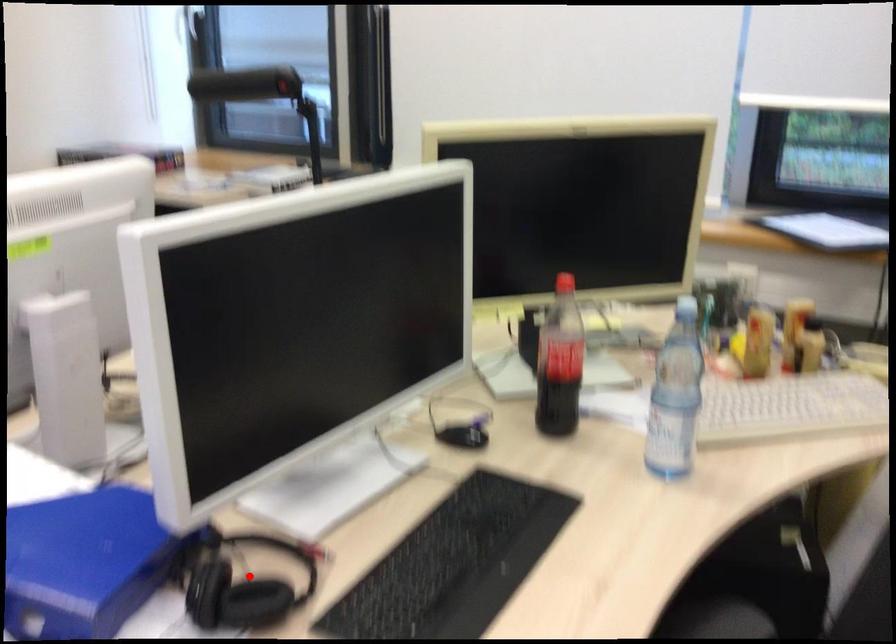
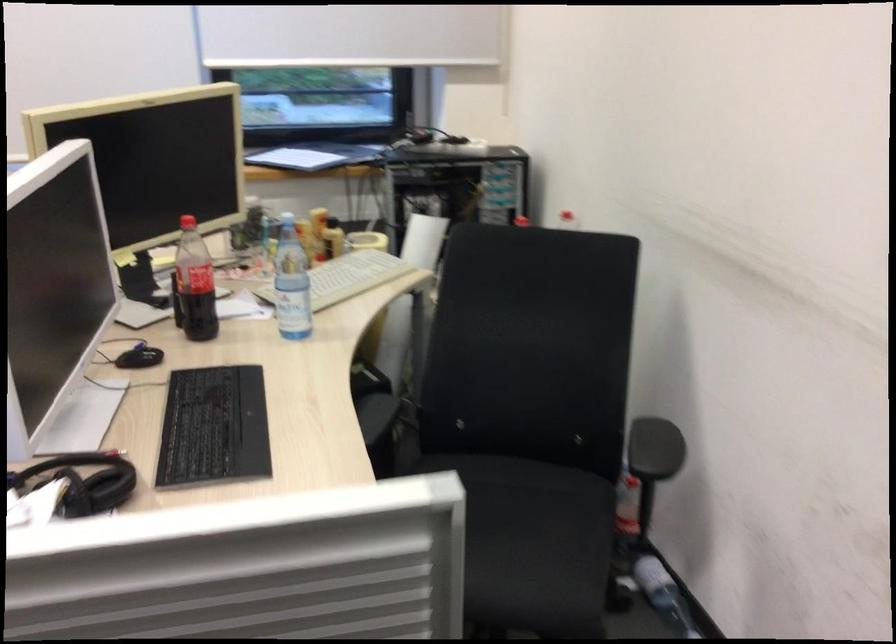
Question: I am providing you with two images of the same scene from different viewpoints. A red point is marked on the first image. At the location where the point appears in image 1, is it still visible in image 2?

Choices:
 (A) Yes
 (B) No

Answer: (A)